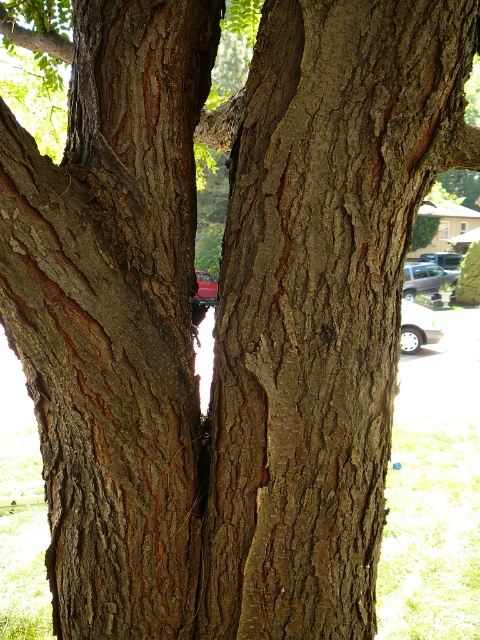
Is point (49, 216) positioned behind point (432, 260)?

No, (49, 216) is closer to viewer.

Does smooth brown bark at center have a greater width compared to metallic silver car at center?

No.

This screenshot has width=480, height=640. Identify the location of smooth brown bark at center. (115, 316).

Is metallic red car at center to the left of metallic silver car at center from the viewer's perspective?

Indeed, metallic red car at center is positioned on the left side of metallic silver car at center.

Is metallic red car at center thinner than metallic silver car at center?

Yes.

Does point (197, 289) come behind point (439, 252)?

No, it is in front of (439, 252).

The width and height of the screenshot is (480, 640). Find the location of `metallic red car at center`. metallic red car at center is located at coordinates (204, 289).

Is point (130, 545) in front of point (405, 326)?

Yes, point (130, 545) is in front of point (405, 326).

Between smooth brown bark at center and silver metallic car at right, which one is positioned lower?

smooth brown bark at center is below.

Which is in front, point (68, 211) or point (408, 317)?

Point (68, 211)

At what (x,y) coordinates should I click in order to perform the action: click on smooth brown bark at center. Please return your answer as a coordinate pair (x, y). The width and height of the screenshot is (480, 640). Looking at the image, I should click on (115, 316).